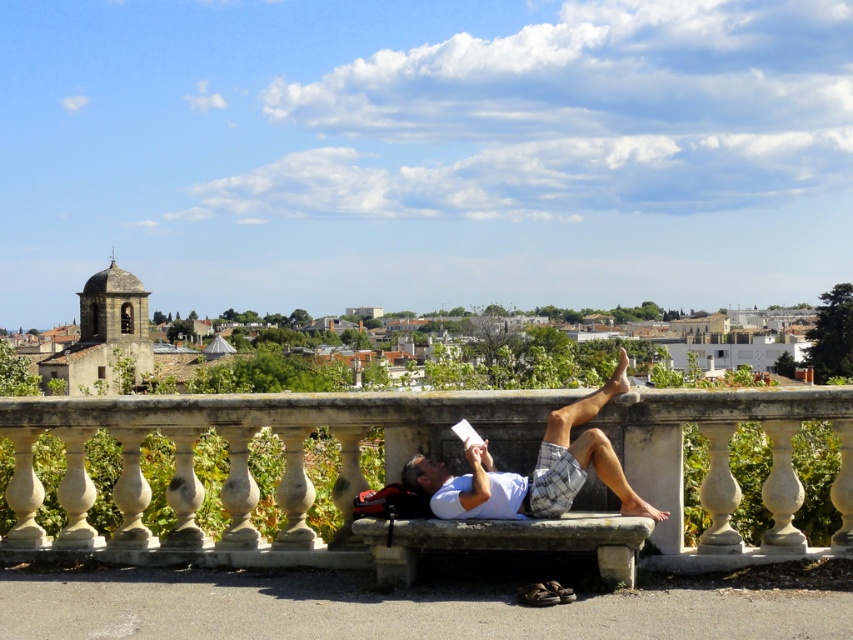
You are a painter standing on a ladder to paint a wall. The ladder is placed between the white stone bench at center and the white cotton shirt at center. If the ladder is 1.8 meters tall, will its height be sufficient to reach the top of the wall that is 2.5 meters high?

The white stone bench at center is taller than the white cotton shirt at center. However, the question does not provide information about the height of the wall or the ladder placement relative to the objects. Therefore, it is impossible to determine if the ladder height is sufficient based on the given details.

You are a photographer wanting to capture the man in the white cotton shirt at center. You have a camera with a 1.2m focal length. The white stone bench at center is between you and the man. Can you see the man clearly through the bench?

The white stone bench at center might be wider than white cotton shirt at center, so there is a possibility that the bench could block the view of the man in the shirt depending on their exact positions.